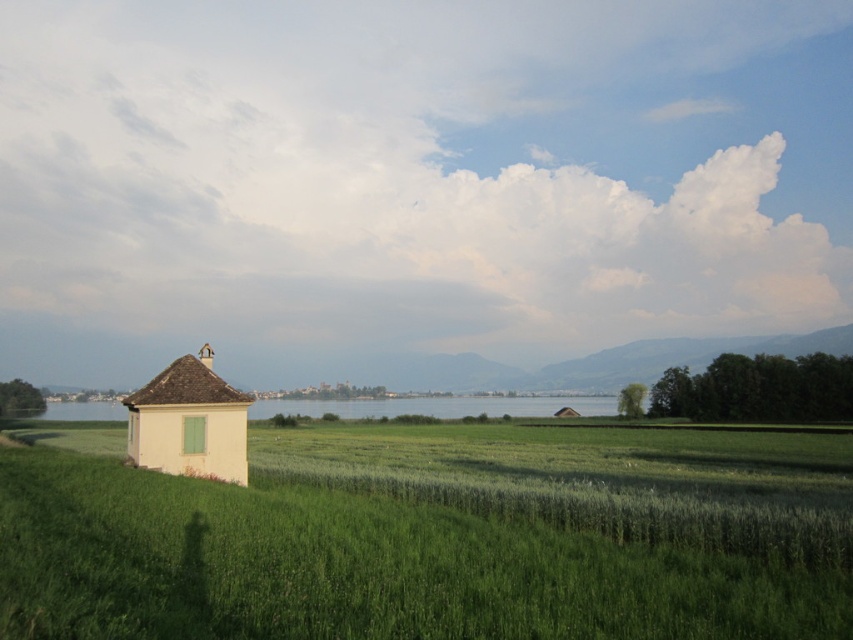
Does point (699, 630) lie behind point (206, 456)?

No, (699, 630) is in front of (206, 456).

Who is taller, green grassy field at lower left or white matte hut at left?

green grassy field at lower left is taller.

Based on the photo, who is more distant from viewer, (410,586) or (177,444)?

The point (177,444) is behind.

Find the location of a particular element. The width and height of the screenshot is (853, 640). green grassy field at lower left is located at coordinates (432, 536).

What do you see at coordinates (189, 422) in the screenshot? The image size is (853, 640). I see `white matte hut at left` at bounding box center [189, 422].

Which is more to the left, white matte hut at left or clear blue water at center?

clear blue water at center

The image size is (853, 640). What do you see at coordinates (189, 422) in the screenshot?
I see `white matte hut at left` at bounding box center [189, 422].

Where is `white matte hut at left`? white matte hut at left is located at coordinates (189, 422).

Who is taller, green grassy field at lower left or clear blue water at center?

clear blue water at center is taller.

Find the location of a particular element. Image resolution: width=853 pixels, height=640 pixels. green grassy field at lower left is located at coordinates (432, 536).

This screenshot has width=853, height=640. Describe the element at coordinates (432, 536) in the screenshot. I see `green grassy field at lower left` at that location.

Locate an element on the screen. The width and height of the screenshot is (853, 640). green grassy field at lower left is located at coordinates (432, 536).